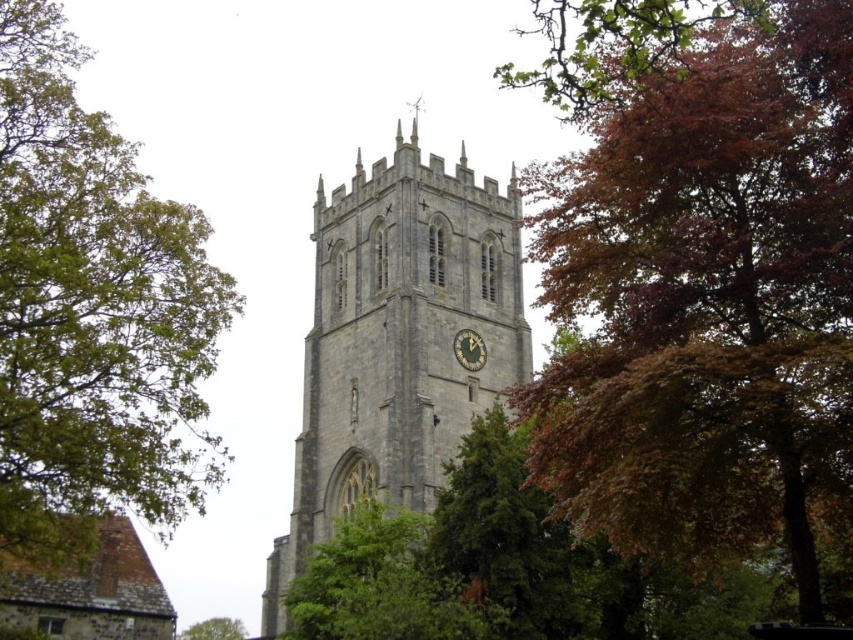
Locate an element on the screen. autumn leaves at upper right is located at coordinates (698, 276).

Consider the image. Can you confirm if autumn leaves at upper right is bigger than dark gray stone clock at center?

Yes.

The width and height of the screenshot is (853, 640). What do you see at coordinates (698, 276) in the screenshot? I see `autumn leaves at upper right` at bounding box center [698, 276].

Locate an element on the screen. The image size is (853, 640). autumn leaves at upper right is located at coordinates (698, 276).

Between autumn leaves at upper right and gray stone church tower at center, which one has more height?

autumn leaves at upper right is taller.

Which is in front, point (727, 502) or point (389, 180)?

Point (727, 502)

The height and width of the screenshot is (640, 853). In order to click on autumn leaves at upper right in this screenshot , I will do `click(698, 276)`.

This screenshot has height=640, width=853. What do you see at coordinates (398, 340) in the screenshot? I see `gray stone church tower at center` at bounding box center [398, 340].

Is gray stone church tower at center positioned at the back of dark gray stone clock at center?

No, gray stone church tower at center is in front of dark gray stone clock at center.

Between point (440, 384) and point (456, 346), which one is positioned behind?

Point (456, 346)

Locate an element on the screen. The width and height of the screenshot is (853, 640). gray stone church tower at center is located at coordinates (398, 340).